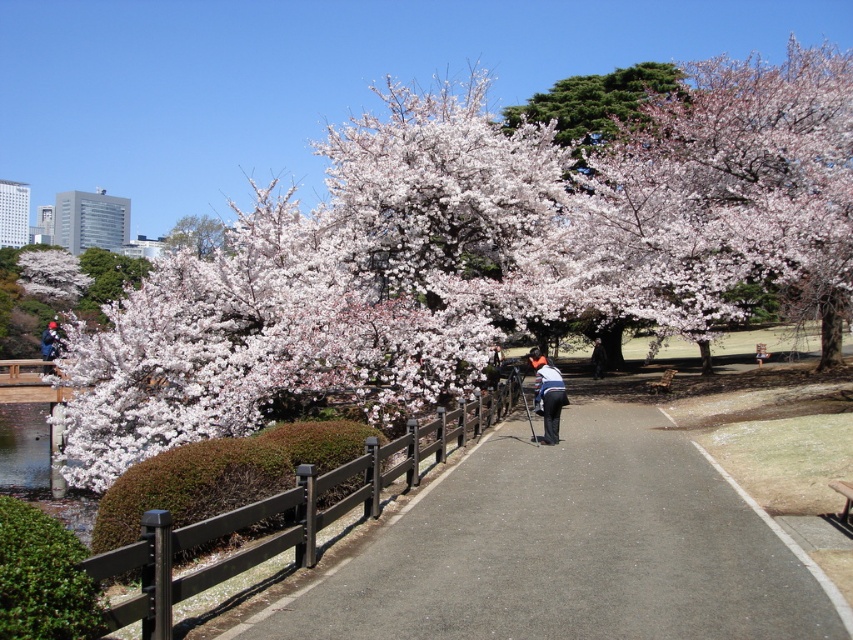
Question: Estimate the real-world distances between objects in this image. Which object is closer to the orange fabric jacket at center?

Choices:
 (A) asphalt path at center
 (B) white matte blossoms at upper left
 (C) matte blue jacket at left

Answer: (A)

Question: In this image, where is white matte blossoms at upper left located relative to orange fabric jacket at center?

Choices:
 (A) left
 (B) right

Answer: (A)

Question: Which point appears closest to the camera in this image?

Choices:
 (A) (83, 483)
 (B) (76, 273)
 (C) (183, 244)

Answer: (A)

Question: Is white matte blossoms at left thinner than white matte blossoms at upper left?

Choices:
 (A) no
 (B) yes

Answer: (A)

Question: Which point is closer to the camera taking this photo?

Choices:
 (A) pos(305,236)
 (B) pos(354,600)
 (C) pos(563,396)

Answer: (B)

Question: Can you confirm if white matte blossoms at upper left is bigger than matte blue jacket at left?

Choices:
 (A) yes
 (B) no

Answer: (B)